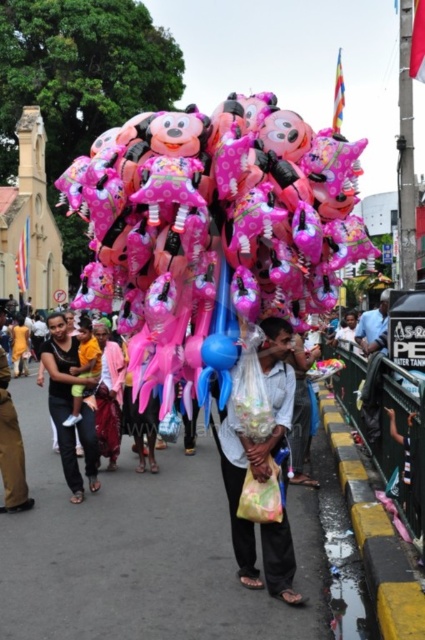
You are at a street festival and see two balloons, a matte pink balloon at center and a blue rubber balloon at center. Which balloon is above the other?

The matte pink balloon at center is positioned over the blue rubber balloon at center.

You are standing at the center of the street and see the point at coordinates point (257, 442). According to the image, what is the object located at that point?

The point (257, 442) is located on matte pink balloons at center.